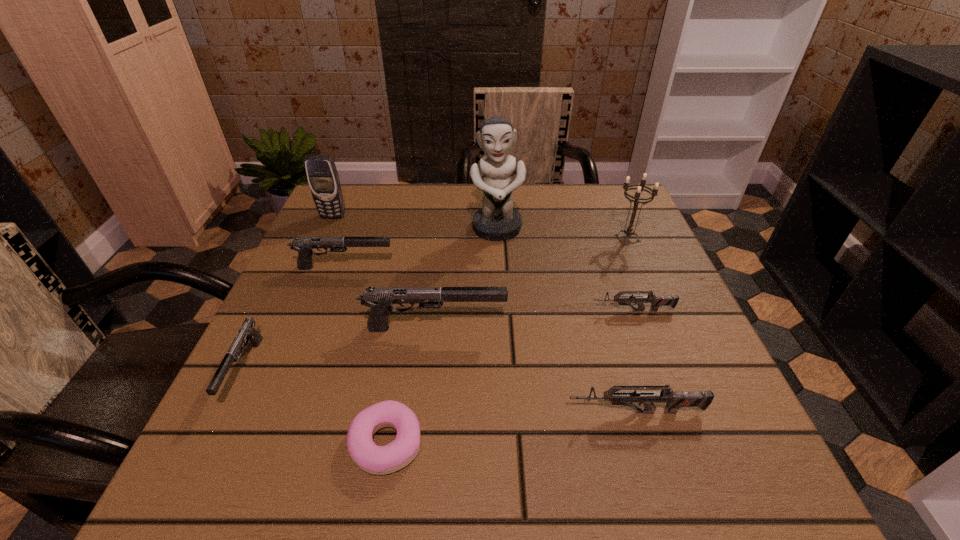
At what (x,y) coordinates should I click in order to perform the action: click on green figurine. Please return your answer as a coordinate pair (x, y). Looking at the image, I should click on (497, 220).

Identify the location of the tallest object. The image size is (960, 540). (497, 220).

Where is `cellular telephone`? Image resolution: width=960 pixels, height=540 pixels. cellular telephone is located at coordinates (323, 178).

Find the location of a particular element. The height and width of the screenshot is (540, 960). candle holder is located at coordinates (629, 230).

Find the location of a particular element. The height and width of the screenshot is (540, 960). the third farthest gun is located at coordinates point(379,299).

The image size is (960, 540). What are the coordinates of `the tallest gun` in the screenshot? It's located at (379, 299).

Where is `the fifth tallest object`? the fifth tallest object is located at coordinates (304, 245).

The image size is (960, 540). I want to click on the farthest gun, so click(x=304, y=245).

This screenshot has height=540, width=960. Identify the location of the nearer grey gun. (675, 399).

I want to click on the nearest gray gun, so click(x=247, y=332).